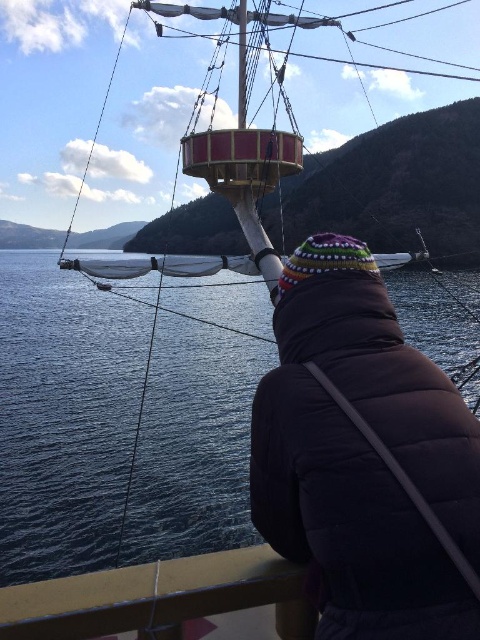
You are standing on the ship and want to walk from the brown wooden deck at lower center to the blue water at center. Is the path clear? Explain why based on their positions.

The brown wooden deck at lower center is behind the blue water at center, so the path to the blue water at center is blocked by the blue water itself. You cannot walk onto the water.